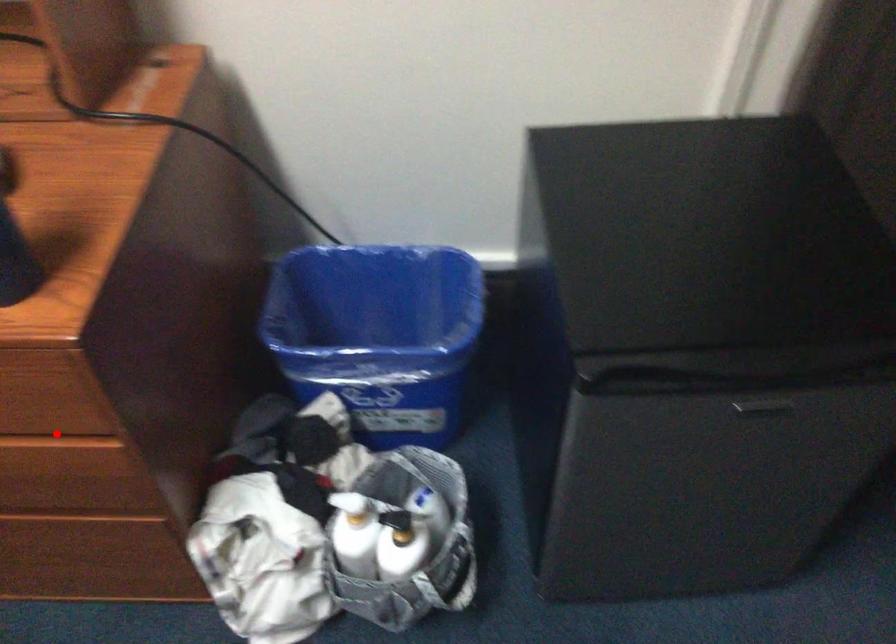
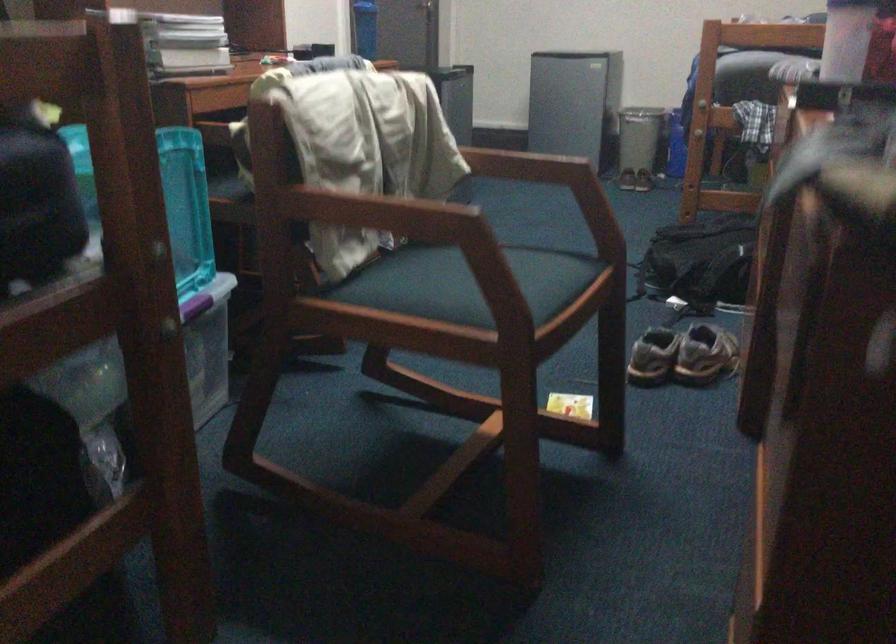
Question: I am providing you with two images of the same scene from different viewpoints. A red point is marked on the first image. Can you still see the location of the red point in image 2?

Choices:
 (A) Yes
 (B) No

Answer: (B)